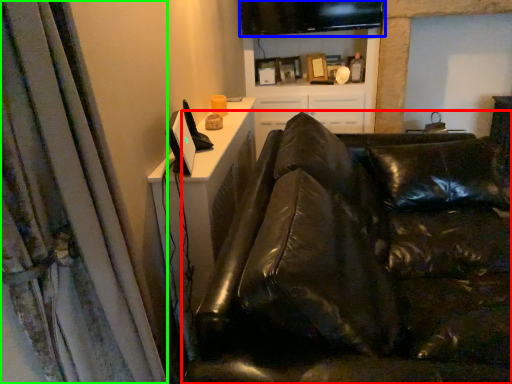
Question: Considering the real-world distances, which object is farthest from studio couch (highlighted by a red box)? computer monitor (highlighted by a blue box) or curtain (highlighted by a green box)?

Choices:
 (A) computer monitor
 (B) curtain

Answer: (A)